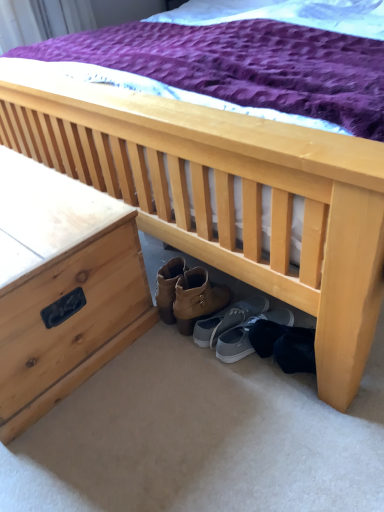
Identify the location of free point above natural wood nightstand at left (from a real-world perspective). (33, 203).